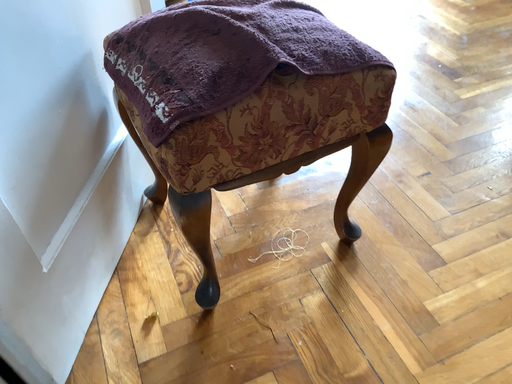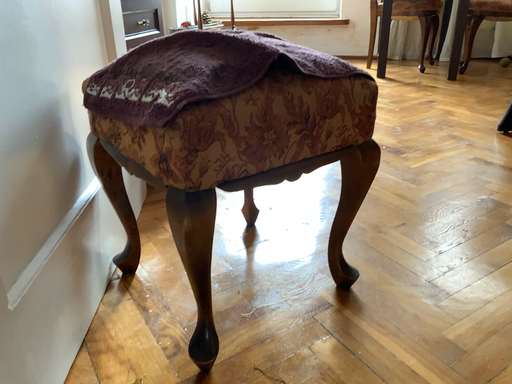
Question: Which way did the camera rotate in the video?

Choices:
 (A) rotated left
 (B) rotated right

Answer: (B)